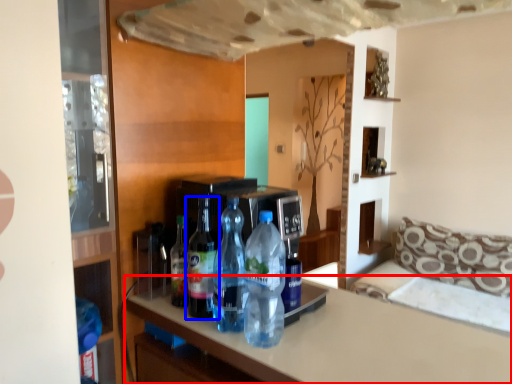
Question: Which object is further to the camera taking this photo, countertop (highlighted by a red box) or bottle (highlighted by a blue box)?

Choices:
 (A) countertop
 (B) bottle

Answer: (B)